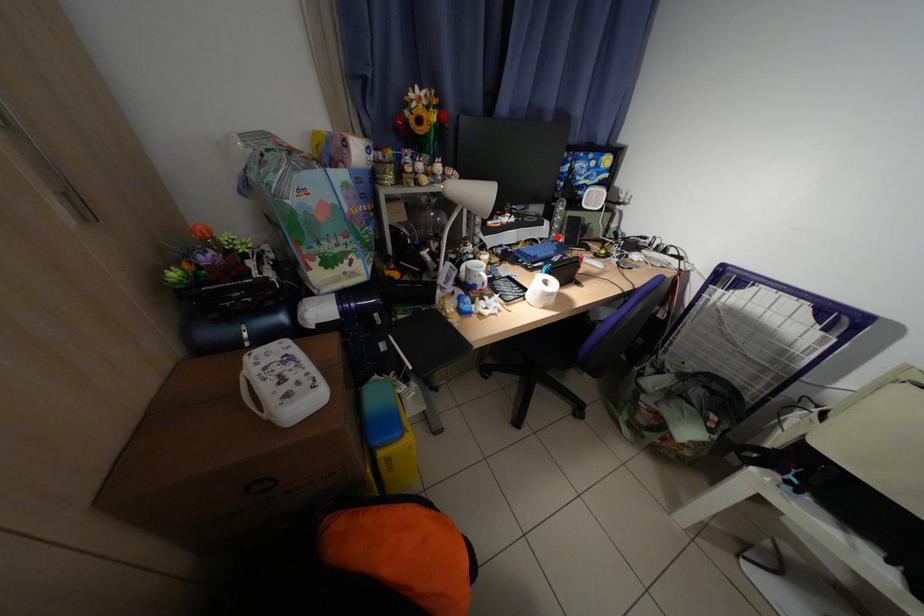
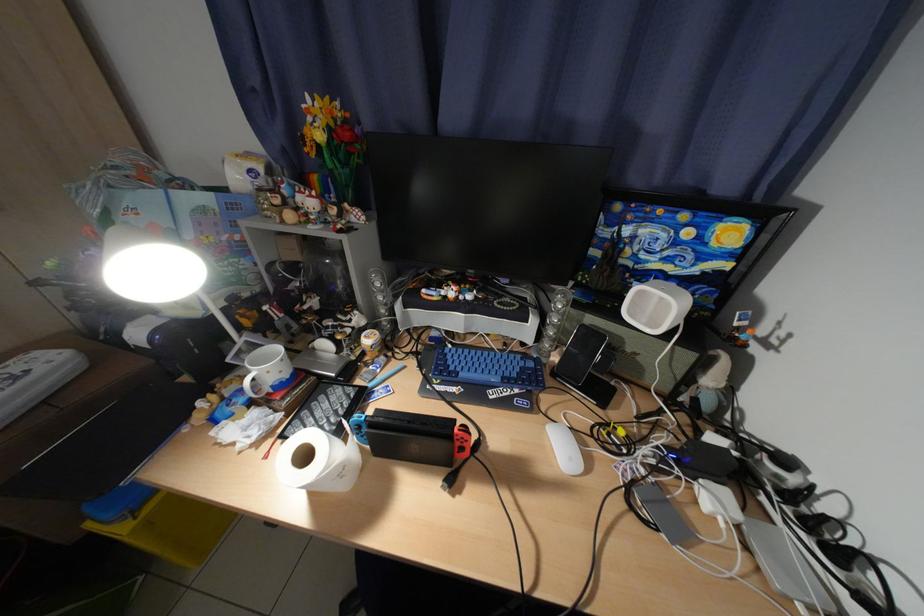
Locate, in the second image, the point that corresponds to the highlighted location in the first image.

(541, 342)